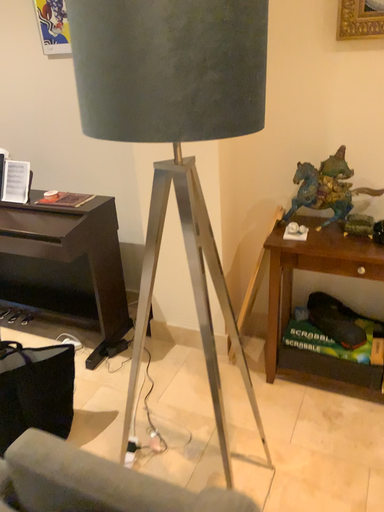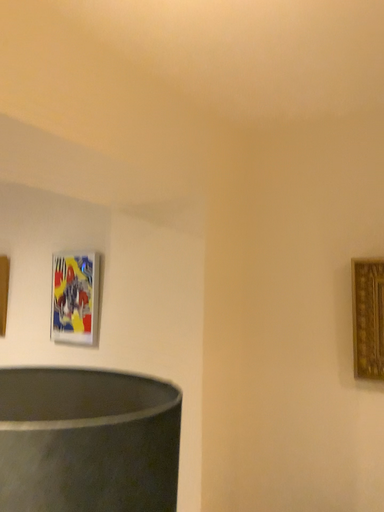
Question: How did the camera likely rotate when shooting the video?

Choices:
 (A) rotated right
 (B) rotated left

Answer: (B)